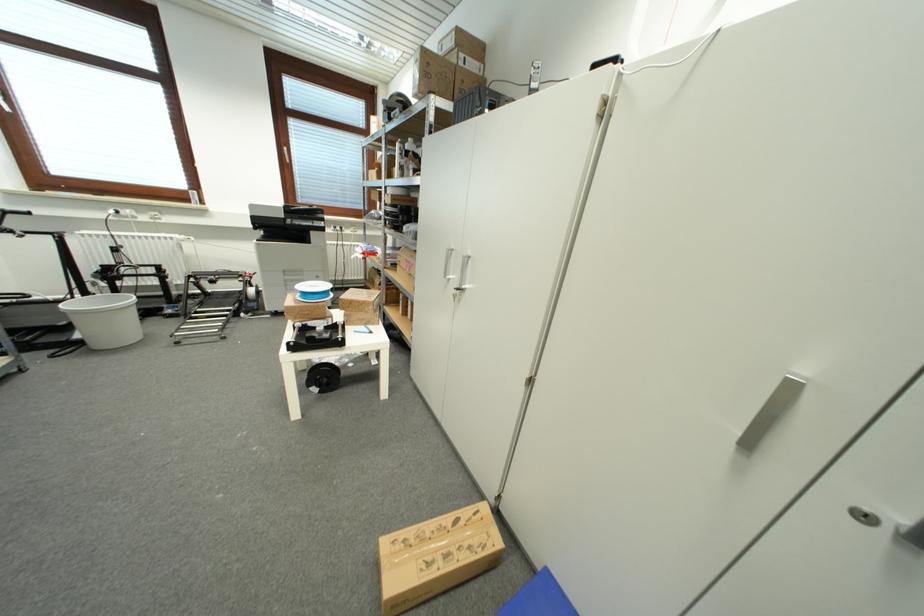
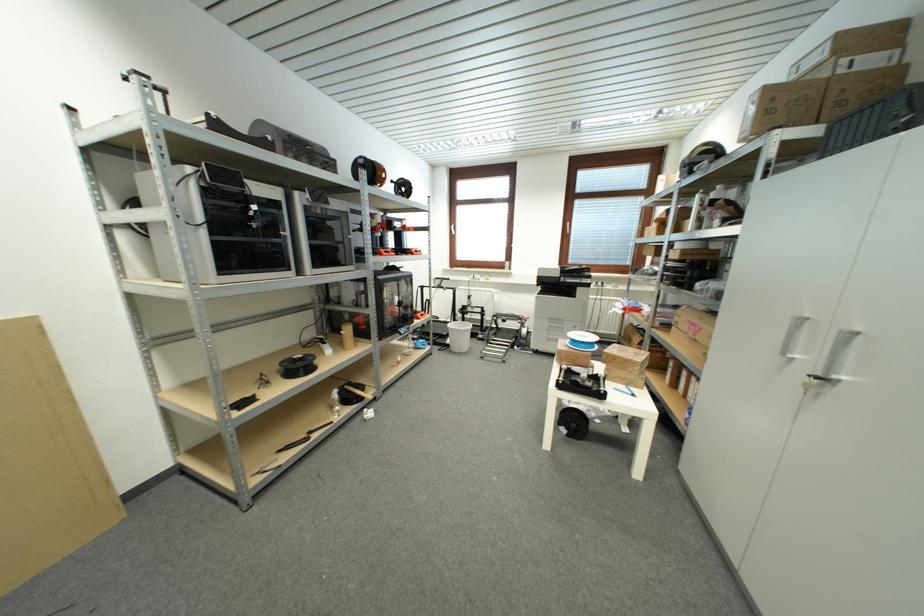
Locate, in the second image, the point that corresponds to (369,305) in the first image.

(634, 363)